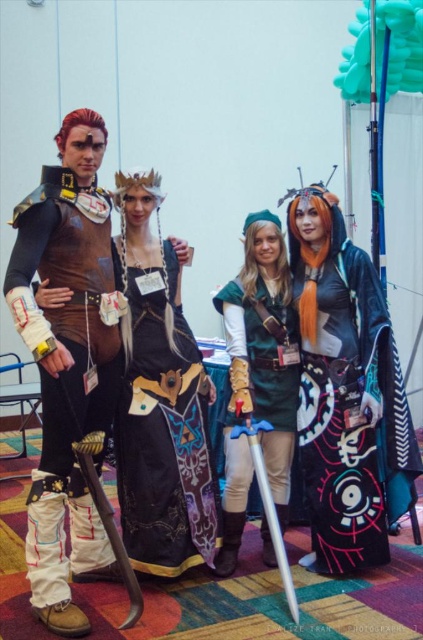
Based on the photo, you are a photographer at the convention and need to ensure all cosplayers are visible in the group photo. Considering the brown leather vest at left and the black satin dress at center, which one might block the view of the other if they stand in a straight line?

The brown leather vest at left is taller than the black satin dress at center, so it might block the view of the black satin dress at center if they stand in a straight line.